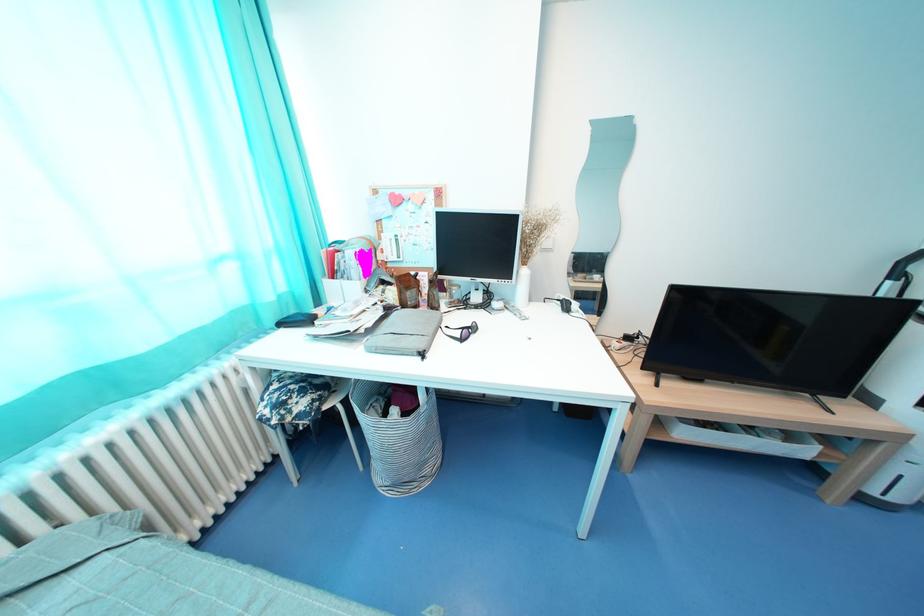
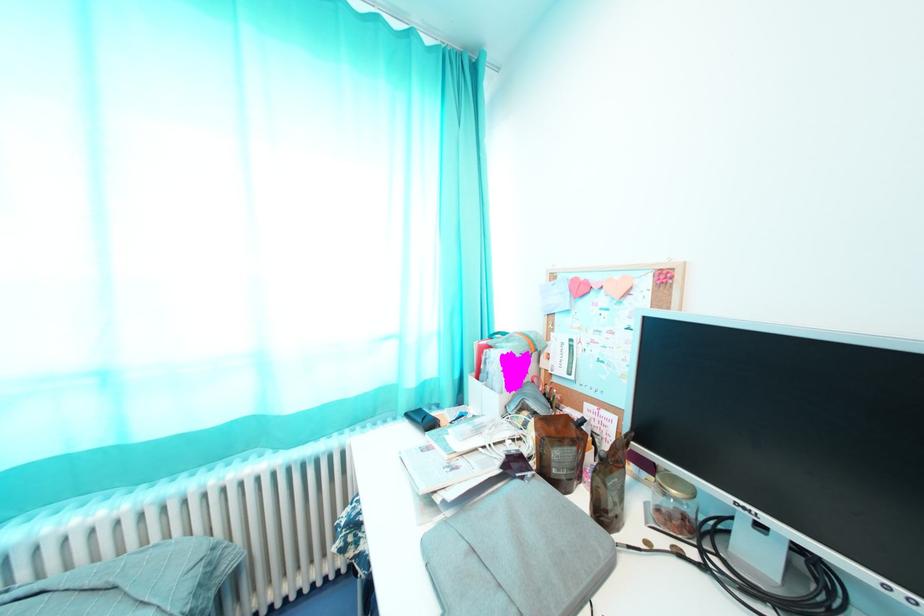
Question: The camera is either moving clockwise (left) or counter-clockwise (right) around the object. The first image is from the beginning of the video and the second image is from the end. Is the camera moving left or right when shooting the video?

Choices:
 (A) Left
 (B) Right

Answer: (B)